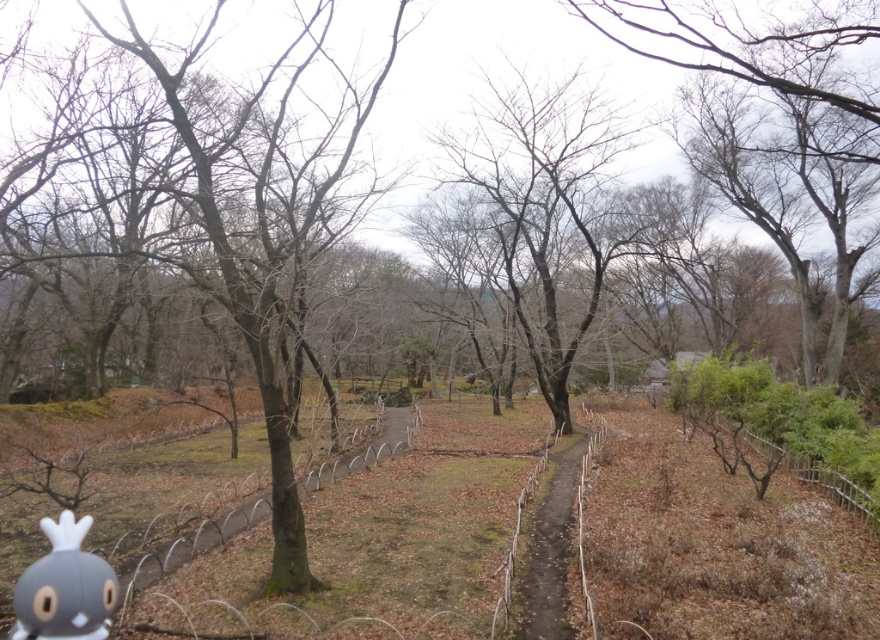
You are a photographer trying to capture a closeup of the bare branches at upper right without the matte gray plush toy at lower left appearing in the frame. Is this possible given their positions?

The bare branches at upper right are further to the viewer than the matte gray plush toy at lower left, so adjusting the camera angle to focus on the branches while angling away from the toy might allow capturing the branches without the toy in the frame.

You are a photographer adjusting your camera to focus on two points in the scene. The first point is at coordinates point (138, 40) and the second is at point (94, 602). Which point is closer to your camera lens?

Point (138, 40) is further to the camera than point (94, 602), so the point closer to the camera lens is point (94, 602).

You are standing in the park and want to take a photo of the bare branches at upper right and the bare branches at center. Which one should you focus on first if you want both to be in sharp focus?

You should focus on the bare branches at center first because it is farther away from the viewer than the bare branches at upper right, so setting focus on the farther object will ensure both are in focus.